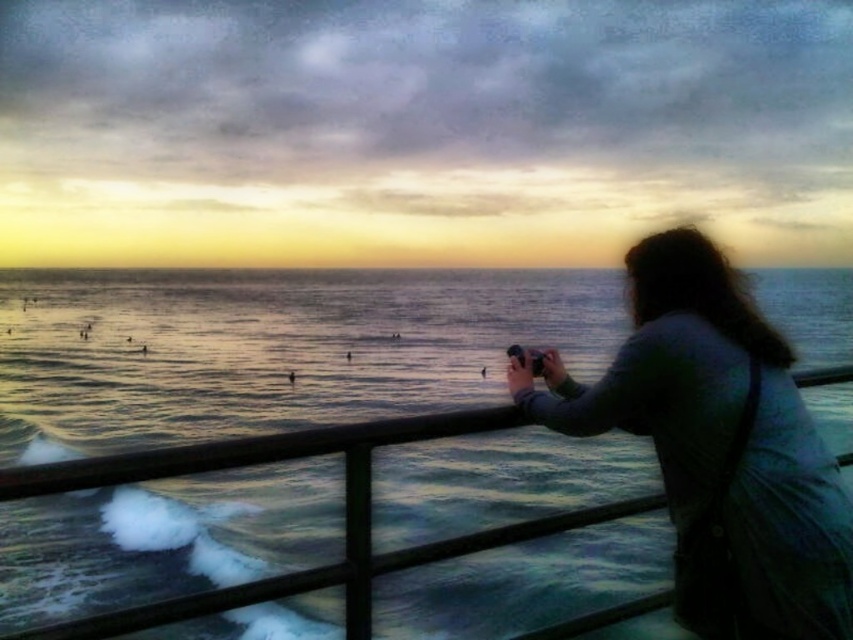
Question: Does blue water at center have a greater width compared to dark gray fabric jacket at right?

Choices:
 (A) yes
 (B) no

Answer: (A)

Question: Considering the relative positions of blue water at center and dark gray fabric jacket at right in the image provided, where is blue water at center located with respect to dark gray fabric jacket at right?

Choices:
 (A) right
 (B) left

Answer: (B)

Question: Can you confirm if blue water at center is smaller than dark gray fabric jacket at right?

Choices:
 (A) no
 (B) yes

Answer: (A)

Question: Which of the following is the closest to the observer?

Choices:
 (A) dark gray fabric jacket at right
 (B) blue water at center

Answer: (A)

Question: Among these points, which one is nearest to the camera?

Choices:
 (A) (749, 548)
 (B) (250, 636)

Answer: (A)